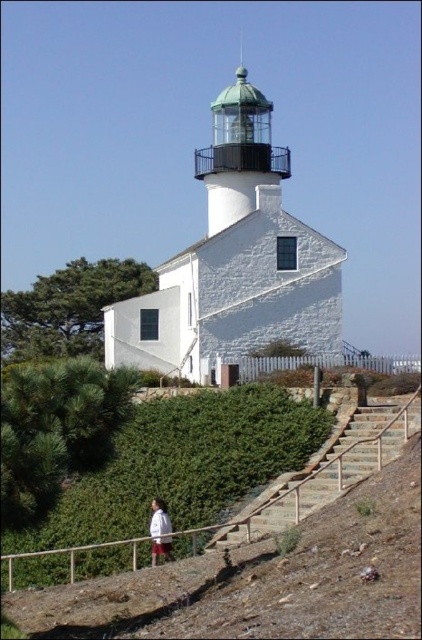
Question: Can you confirm if brown wooden rail at lower center is positioned to the right of brown stone stairs at lower right?

Choices:
 (A) no
 (B) yes

Answer: (A)

Question: Is brown wooden rail at lower center thinner than brown stone stairs at lower right?

Choices:
 (A) yes
 (B) no

Answer: (B)

Question: Where is brown stone stairs at lower right located in relation to white cotton shirt at lower center in the image?

Choices:
 (A) left
 (B) right

Answer: (B)

Question: Estimate the real-world distances between objects in this image. Which object is closer to the brown stone stairs at lower right?

Choices:
 (A) white cotton shirt at lower center
 (B) brown wooden rail at lower center

Answer: (B)

Question: Which point appears closest to the camera in this image?

Choices:
 (A) (262, 529)
 (B) (354, 458)
 (C) (165, 529)

Answer: (A)

Question: Which object appears closest to the camera in this image?

Choices:
 (A) white cotton shirt at lower center
 (B) brown wooden rail at lower center

Answer: (B)